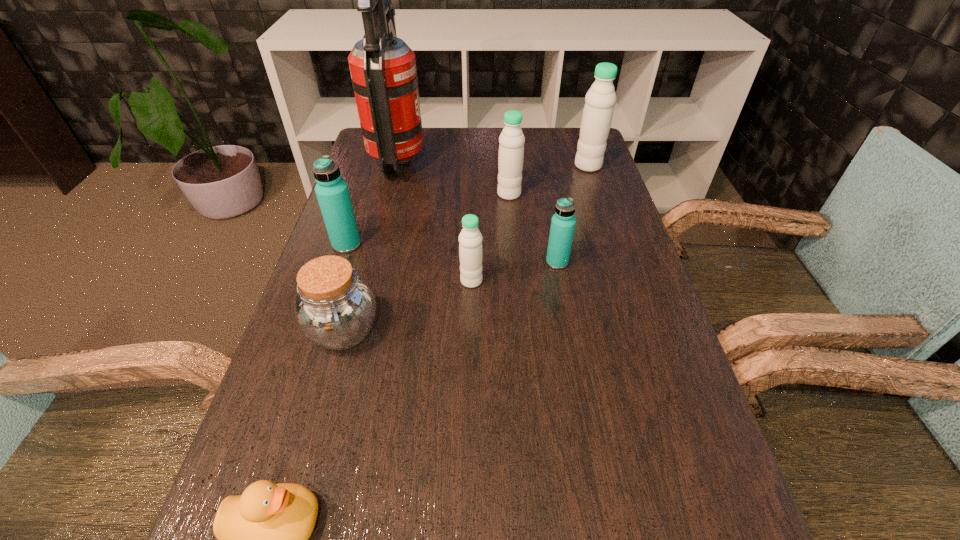
The width and height of the screenshot is (960, 540). I want to click on free space located 0.200m on the front of the brown jar, so click(x=306, y=467).

Locate an element on the screen. fire extinguisher located at the far edge is located at coordinates (383, 71).

Image resolution: width=960 pixels, height=540 pixels. Identify the location of water bottle at the far edge. (600, 99).

Locate an element on the screen. fire extinguisher that is positioned at the left edge is located at coordinates (383, 71).

Image resolution: width=960 pixels, height=540 pixels. I want to click on water bottle that is at the left edge, so click(x=332, y=192).

I want to click on jar situated at the left edge, so click(x=334, y=307).

I want to click on object located in the right edge section of the desktop, so click(x=600, y=99).

Find the location of a particular element. The height and width of the screenshot is (540, 960). object that is at the far left corner is located at coordinates (383, 71).

The width and height of the screenshot is (960, 540). I want to click on object that is positioned at the far right corner, so click(x=600, y=99).

Locate an element on the screen. The height and width of the screenshot is (540, 960). vacant area at the far edge of the desktop is located at coordinates (450, 142).